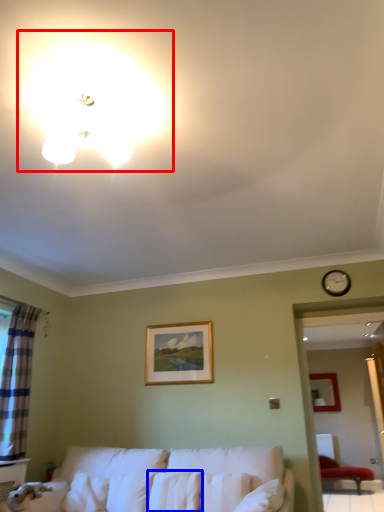
Question: Which of the following is the closest to the observer, lighting (highlighted by a red box) or pillow (highlighted by a blue box)?

Choices:
 (A) lighting
 (B) pillow

Answer: (A)